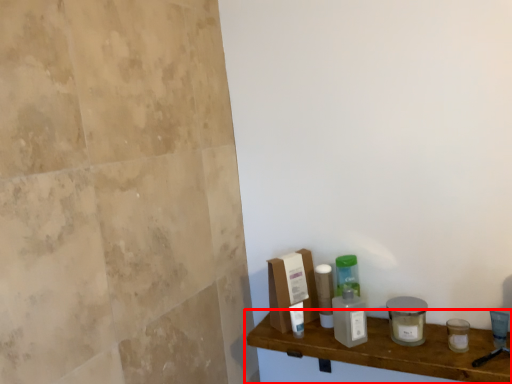
Question: Observing the image, what is the correct spatial positioning of shelf (annotated by the red box) in reference to cleaning product?

Choices:
 (A) right
 (B) left

Answer: (A)